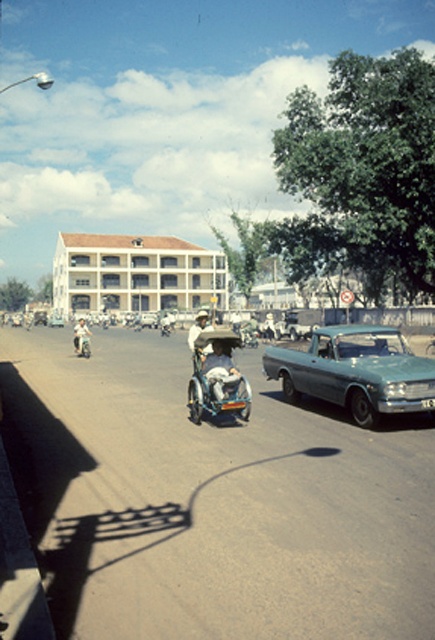
You are a delivery person who needs to know if the teal metallic car at right can fit under a low bridge that is only as tall as the light brown leather jacket at center. Can it pass under the bridge?

The teal metallic car at right has a lesser height compared to the light brown leather jacket at center. Since the bridge is as tall as the jacket, the car can pass under the bridge without any issues.

You are a delivery drone flying above the street scene. You need to deliver a package to the teal metallic car at right. According to the coordinates provided, where should you drop the package?

The teal metallic car at right is located at point (x=355, y=371), so you should drop the package at those coordinates.

You are a delivery drone flying above the street scene. You need to drop a package at the point labeled as point (402,344). However, there is another point labeled as point (207,317) in the area. Which point is closer to you if you are directly above the vintage car on the right side of the road?

Point (402,344) is in front of point (207,317), so the package should be dropped at point (402,344) as it is closer to your current position above the vintage car.